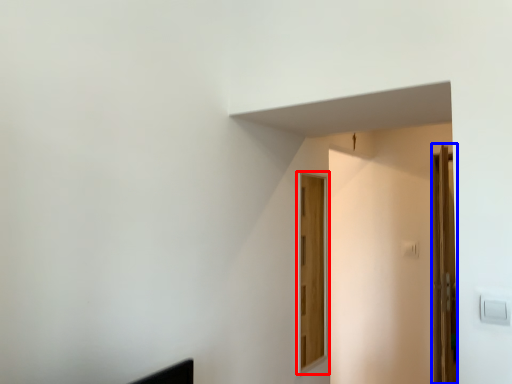
Question: Which of the following is the farthest to the observer, door (highlighted by a red box) or door (highlighted by a blue box)?

Choices:
 (A) door
 (B) door

Answer: (B)